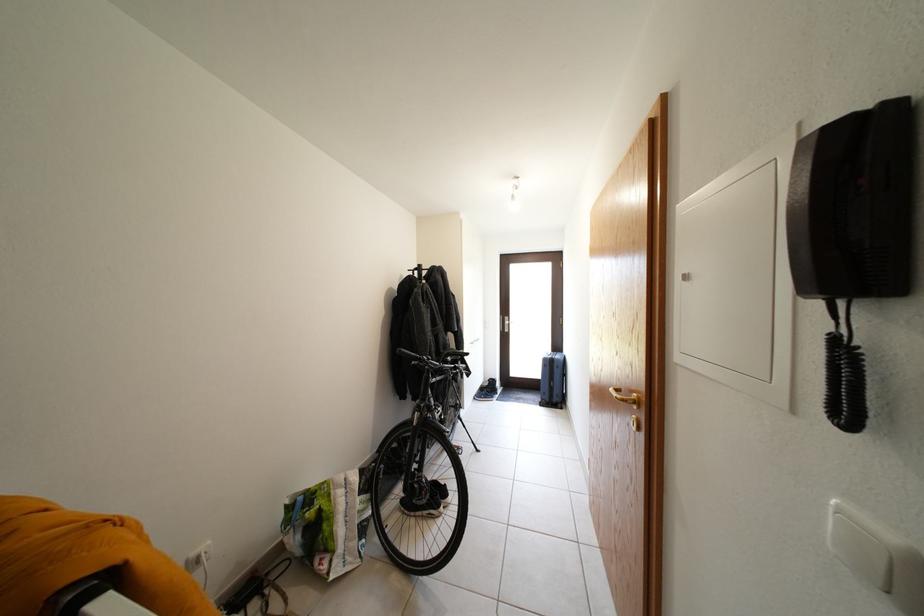
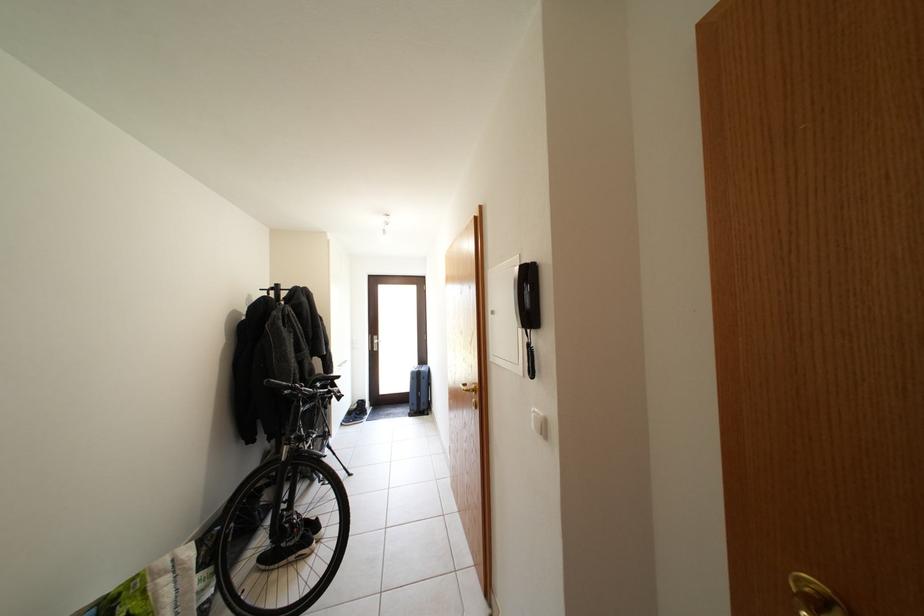
In the second image, find the point that corresponds to (x=419, y=361) in the first image.

(289, 390)